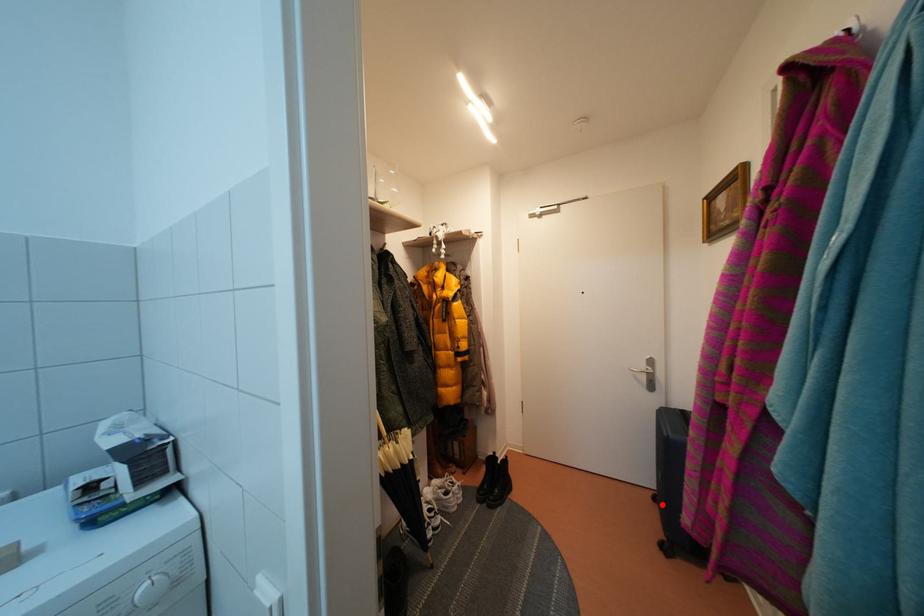
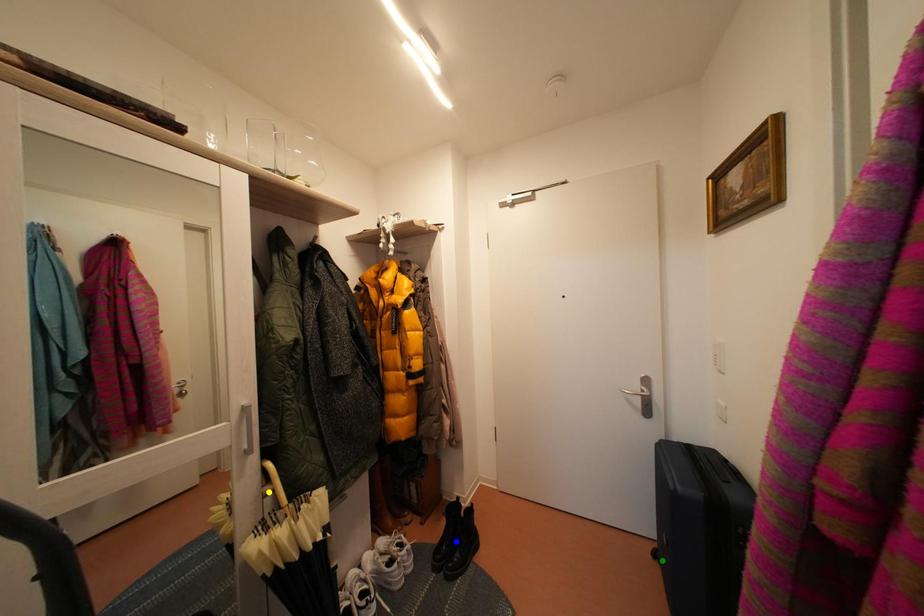
Question: I am providing you with two images of the same scene from different viewpoints. A red point is marked on the first image. You are given multiple points on the second image. In image 2, which mark is for the same physical point as the one in image 1?

Choices:
 (A) yellow point
 (B) blue point
 (C) green point

Answer: (C)